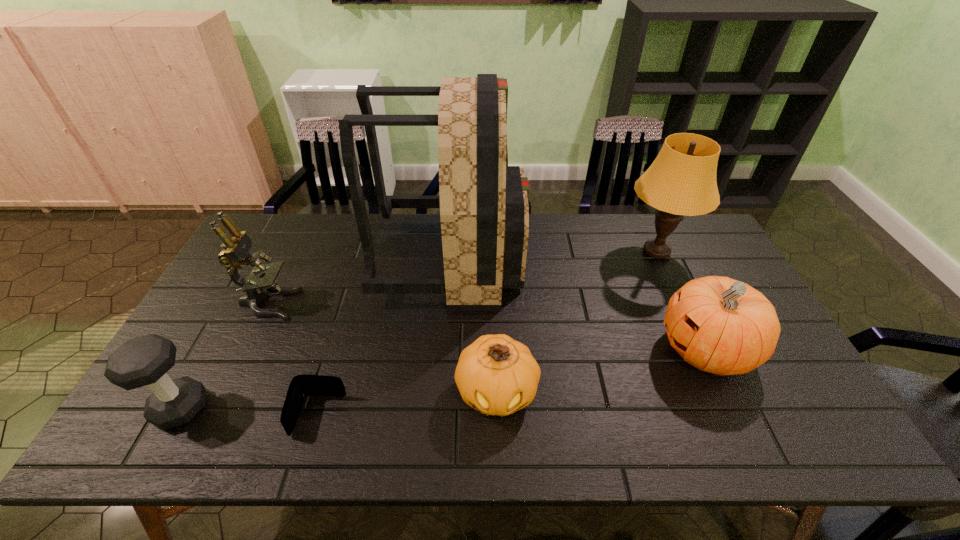
Where is `backpack`? backpack is located at coordinates (484, 211).

This screenshot has width=960, height=540. What are the coordinates of `the second tallest object` in the screenshot? It's located at coord(681,181).

You are a GUI agent. You are given a task and a screenshot of the screen. Output one action in this format:
    pyautogui.click(x=<x>, y=<y>)
    Task: Click on the fifth shortest object
    The image size is (960, 540).
    Given the screenshot: What is the action you would take?
    pyautogui.click(x=235, y=253)

Locate an element on the screen. the right pumpkin is located at coordinates (719, 325).

Where is `dumbbell`? dumbbell is located at coordinates (141, 361).

The image size is (960, 540). In order to click on the left pumpkin in this screenshot , I will do `click(496, 375)`.

Locate an element on the screen. The height and width of the screenshot is (540, 960). the shortest object is located at coordinates (303, 385).

Find the location of a particular element. This screenshot has width=960, height=540. vacant area situated on the front face of the backpack is located at coordinates (574, 259).

Locate an element on the screen. The width and height of the screenshot is (960, 540). vacant space located on the front of the lampshade is located at coordinates (675, 292).

Identify the location of free spot located at the eyepieces of the microscope. (361, 304).